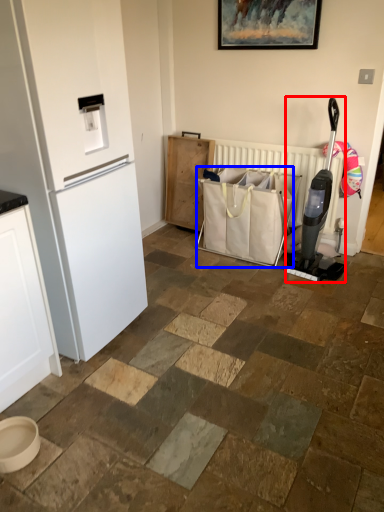
Question: Which object appears farthest to the camera in this image, appliance (highlighted by a red box) or shopping bag (highlighted by a blue box)?

Choices:
 (A) appliance
 (B) shopping bag

Answer: (B)